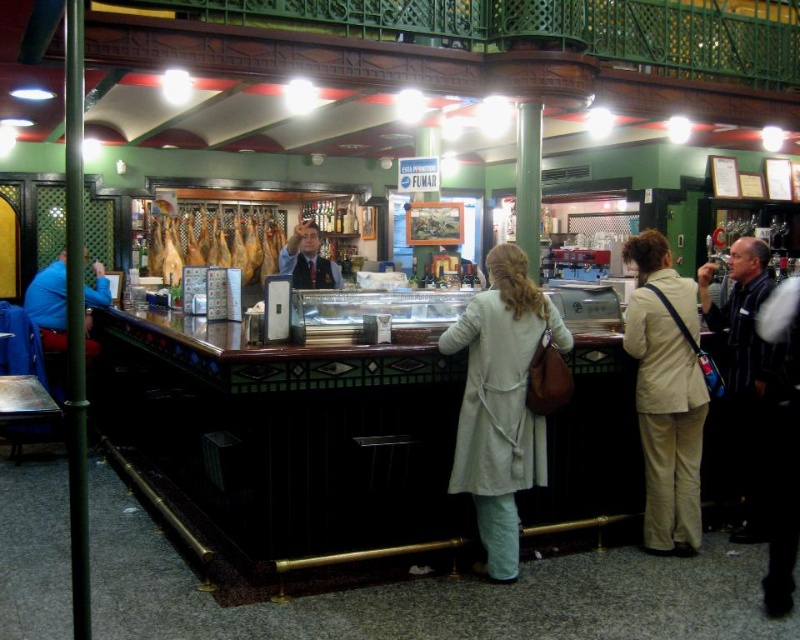
You are a customer entering the tapas bar and see the light beige coat at center. If you want to grab your coat without moving from your current position, can you reach it?

The light beige coat at center is 3.97 meters away from camera, which is too far to reach without moving closer. You need to approach the coat to grab it.

You are a customer at the tapas bar and want to place your beige fabric coat at center on the counter next to the smoked ham at center. Considering their sizes, will the coat fit on the counter without overlapping the ham?

The beige fabric coat at center has a lesser width compared to smoked ham at center, so it will fit on the counter without overlapping the ham.

You are a customer entering the tapas bar and notice two coats hanging at the center of the counter. The light beige coat at center and the beige fabric coat at center. Which coat is shorter?

The light beige coat at center is shorter than the beige fabric coat at center.